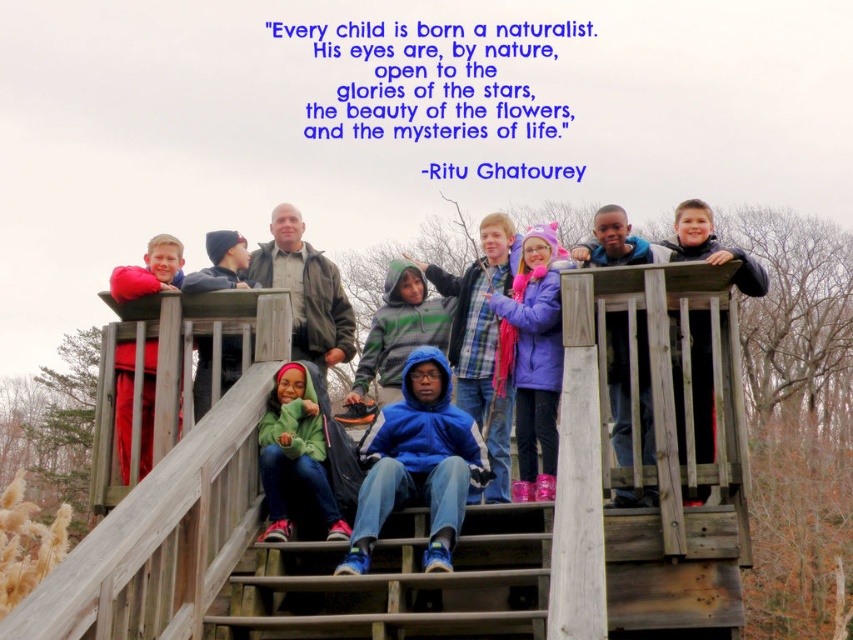
You are a parent trying to guide your child to the wooden staircase at center while holding a green fleece jacket at center. Can you walk through the staircase while holding the jacket without dropping it?

The wooden staircase at center is wider than the green fleece jacket at center, so yes, you can walk through the staircase while holding the jacket without dropping it because the staircase is wide enough to accommodate both your movement and the jacket.

You are a tour guide leading a group of children on an observation deck. You need to hand out a map to a child wearing the green fleece jacket at center. The map is currently on the wooden staircase at center. Can you reach the map without moving from your current position?

The wooden staircase at center is 6.20 meters away from green fleece jacket at center. Since the distance is significant, you would need to move closer to retrieve the map from the wooden staircase at center and hand it to the child wearing the green fleece jacket at center.